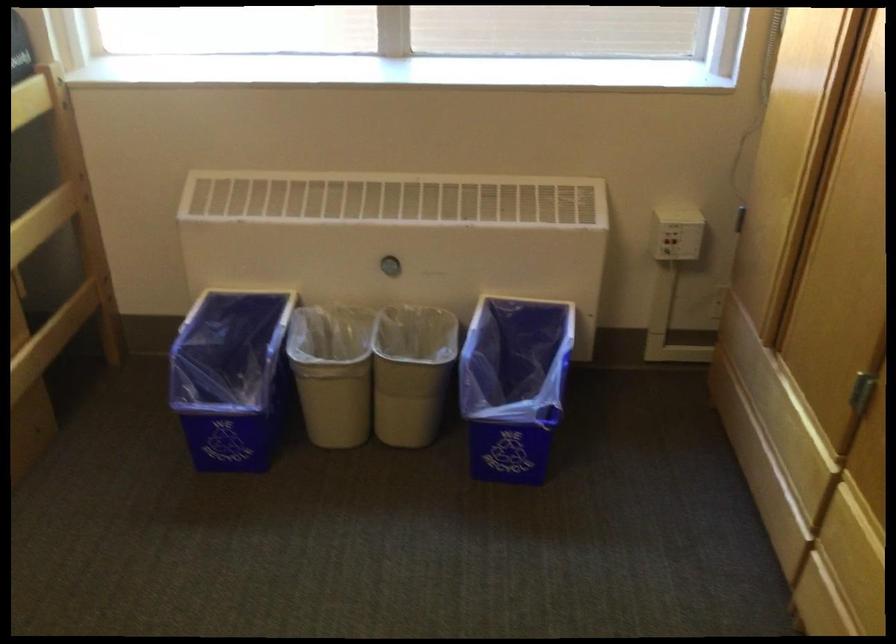
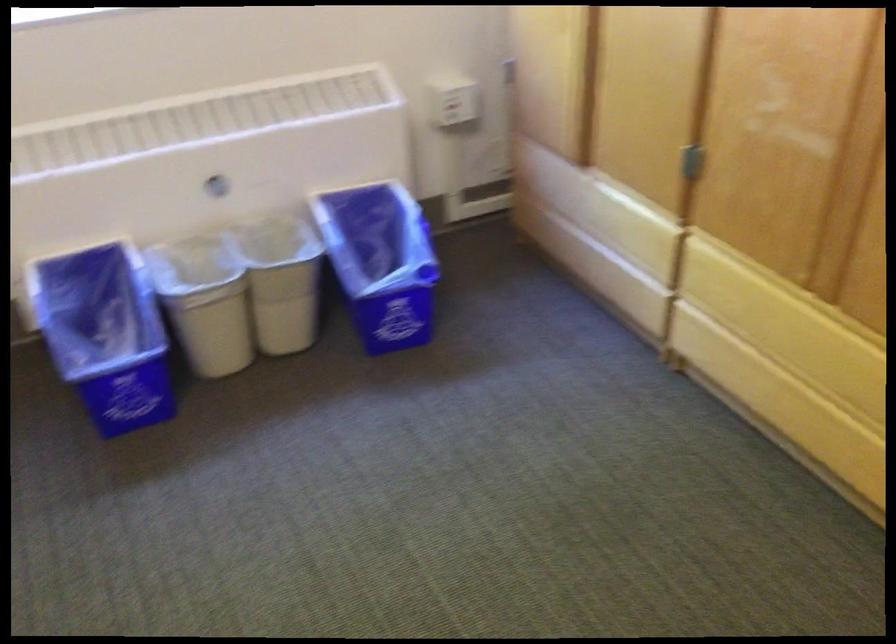
Question: How did the camera likely rotate?

Choices:
 (A) Left
 (B) Right
 (C) Up
 (D) Down

Answer: (B)